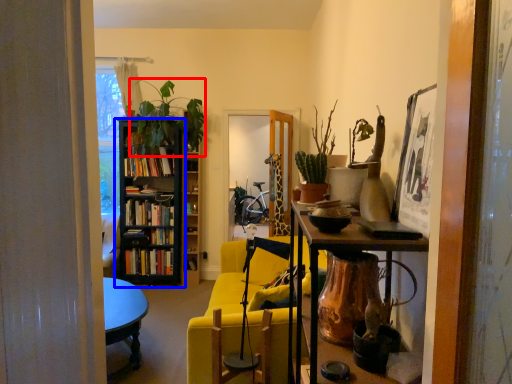
Question: Which point is closer to the camera, plant (highlighted by a red box) or bookcase (highlighted by a blue box)?

Choices:
 (A) plant
 (B) bookcase

Answer: (A)